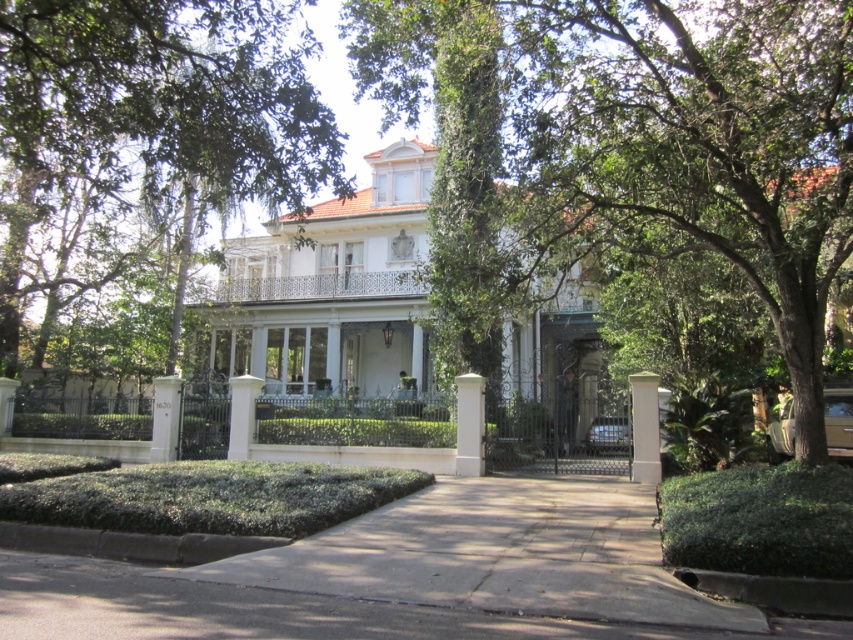
Is white smooth pillar at center above white stone column at center?

Yes.

In order to click on white smooth pillar at center in this screenshot , I will do `click(469, 424)`.

At what (x,y) coordinates should I click in order to perform the action: click on white smooth pillar at center. Please return your answer as a coordinate pair (x, y). The height and width of the screenshot is (640, 853). Looking at the image, I should click on (469, 424).

Is white smooth column at center to the left of white painted concrete pillar at lower left from the viewer's perspective?

Incorrect, white smooth column at center is not on the left side of white painted concrete pillar at lower left.

Who is more distant from viewer, (634, 467) or (161, 428)?

Point (161, 428)

The height and width of the screenshot is (640, 853). Identify the location of white smooth column at center. (645, 428).

Can you confirm if paved concrete driveway at center is shorter than white smooth pillar at center?

Indeed, paved concrete driveway at center has a lesser height compared to white smooth pillar at center.

Locate an element on the screen. Image resolution: width=853 pixels, height=640 pixels. paved concrete driveway at center is located at coordinates click(x=408, y=577).

Find the location of a particular element. Image resolution: width=853 pixels, height=640 pixels. paved concrete driveway at center is located at coordinates (408, 577).